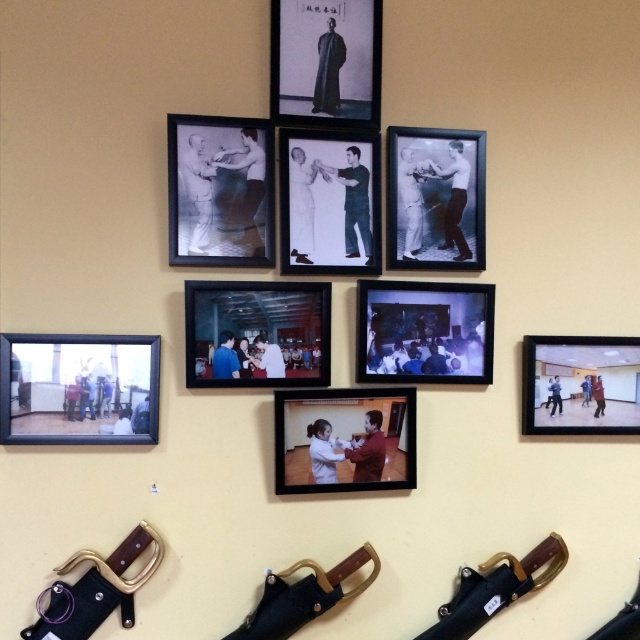
Question: Which point is closer to the camera taking this photo?

Choices:
 (A) (573, 416)
 (B) (280, 392)

Answer: (B)

Question: Is black matte picture frame at upper center to the left of matte plastic photo frame at center from the viewer's perspective?

Choices:
 (A) no
 (B) yes

Answer: (A)

Question: Estimate the real-world distances between objects in this image. Which object is closer to the black matte picture frame at upper left?

Choices:
 (A) matte plastic photo frame at center
 (B) black matte photograph at upper center
 (C) matte black frame at upper right

Answer: (A)

Question: Does black paper at center have a smaller size compared to matte plastic photo frame at center?

Choices:
 (A) no
 (B) yes

Answer: (B)

Question: Which object is positioned farthest from the matte plastic picture frame at center?

Choices:
 (A) black matte photograph at upper center
 (B) matte black frame at upper right
 (C) black matte picture frame at upper center
 (D) matte plastic picture frame at lower left

Answer: (D)

Question: Can you confirm if matte plastic picture frame at lower left is positioned to the right of matte black frame at upper right?

Choices:
 (A) no
 (B) yes

Answer: (A)